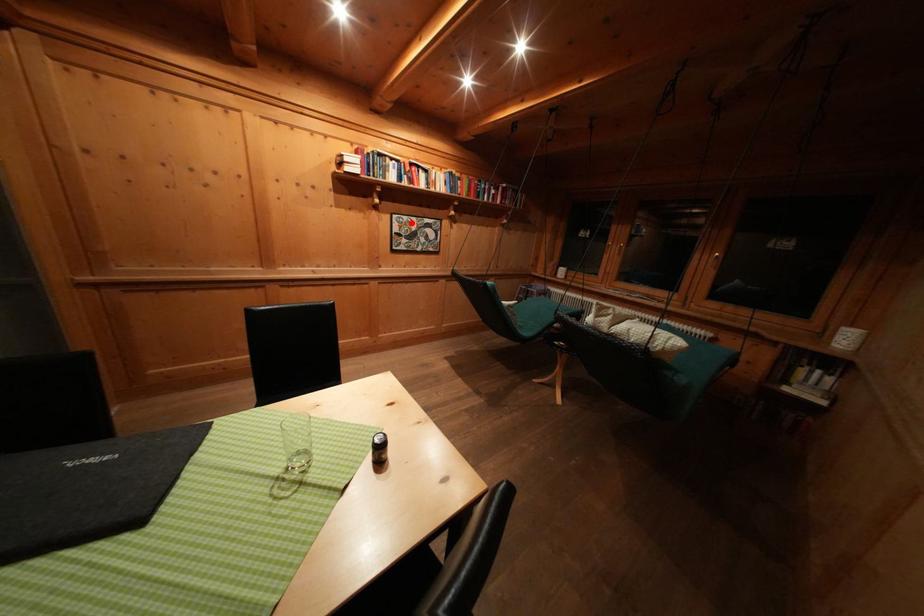
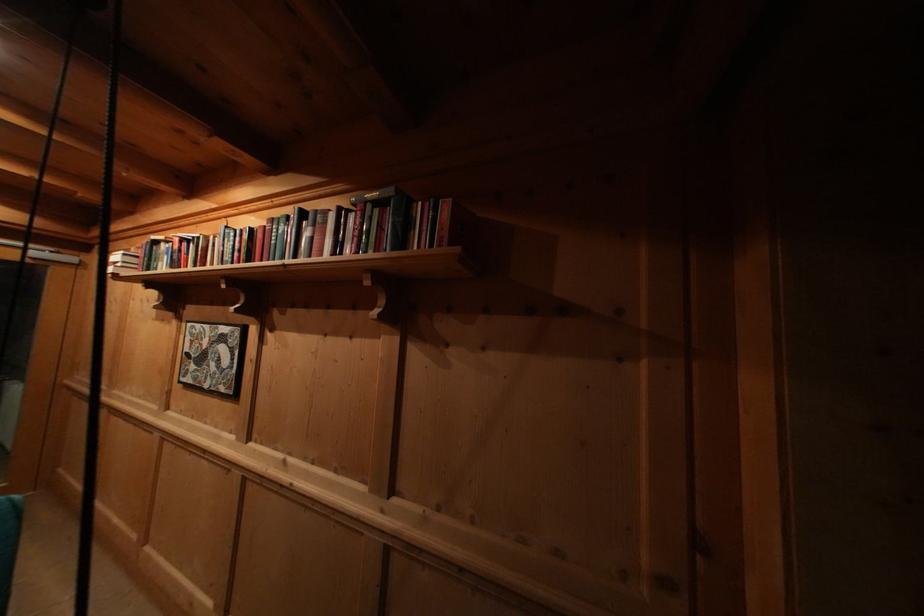
Question: A red point is marked in image1. In image2, is the corresponding 3D point closer to the camera or farther? Reply with the corresponding letter.

Choices:
 (A) The corresponding 3D point is closer.
 (B) The corresponding 3D point is farther.

Answer: (B)